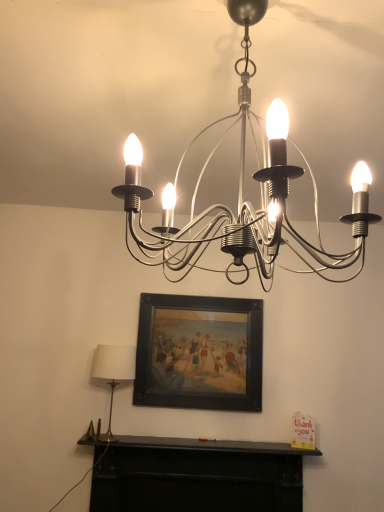
Question: From the image's perspective, is satin silver chandelier at upper center, placed as the 1th lamp when sorted from top to bottom, positioned above or below black matte fireplace at lower center?

Choices:
 (A) below
 (B) above

Answer: (B)

Question: Looking at their shapes, would you say satin silver chandelier at upper center, placed as the 1th lamp when sorted from top to bottom, is wider or thinner than black matte fireplace at lower center?

Choices:
 (A) thin
 (B) wide

Answer: (B)

Question: Estimate the real-world distances between objects in this image. Which object is closer to the white fabric lampshade at left, which appears as the first lamp when ordered from the bottom?

Choices:
 (A) black wooden picture frame at center
 (B) black matte fireplace at lower center
 (C) satin silver chandelier at upper center, the 2th lamp in the bottom-to-top sequence

Answer: (A)

Question: Which is farther from the satin silver chandelier at upper center, marked as the 1th lamp in a right-to-left arrangement?

Choices:
 (A) black matte fireplace at lower center
 (B) white fabric lampshade at left, acting as the 2th lamp starting from the front
 (C) black wooden picture frame at center

Answer: (A)